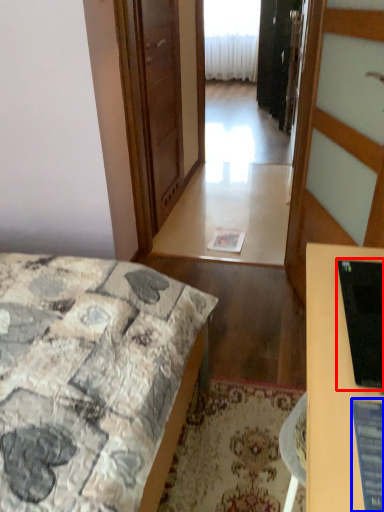
Question: Which of the following is the farthest to the observer, computer monitor (highlighted by a red box) or computer screen (highlighted by a blue box)?

Choices:
 (A) computer monitor
 (B) computer screen

Answer: (A)